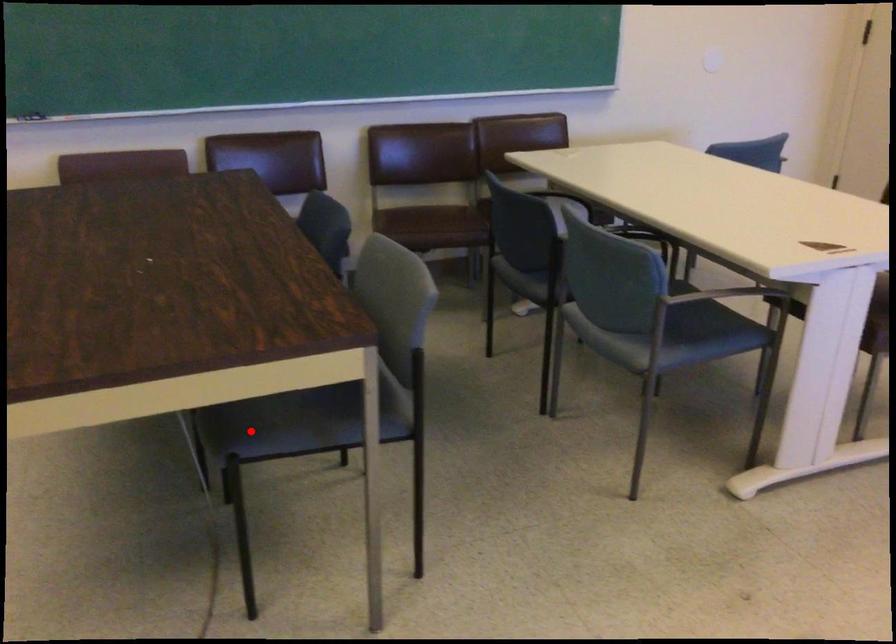
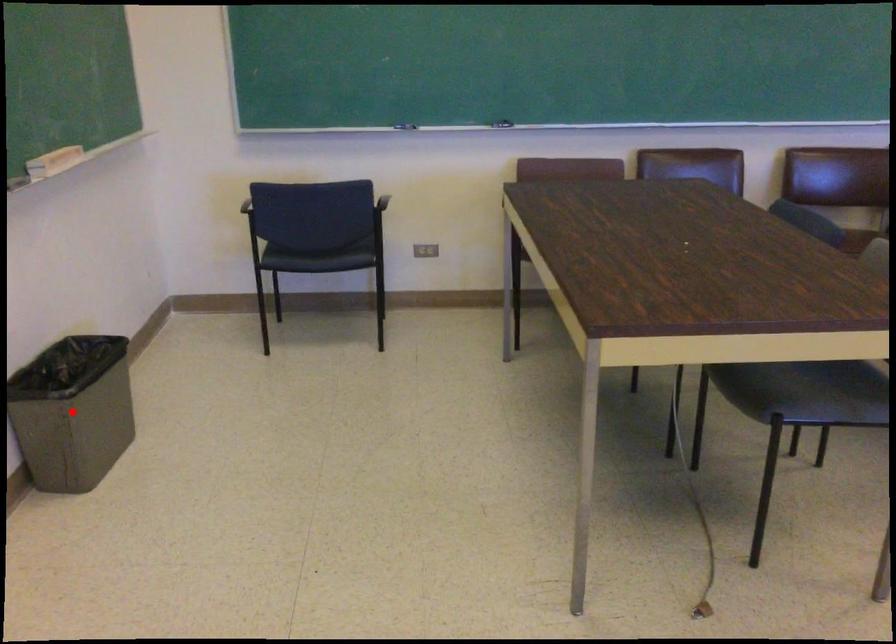
I am providing you with two images of the same scene from different viewpoints. A red point is marked on the first image and another point is marked on the second image. Is the marked point in image1 the same physical position as the marked point in image2?

No